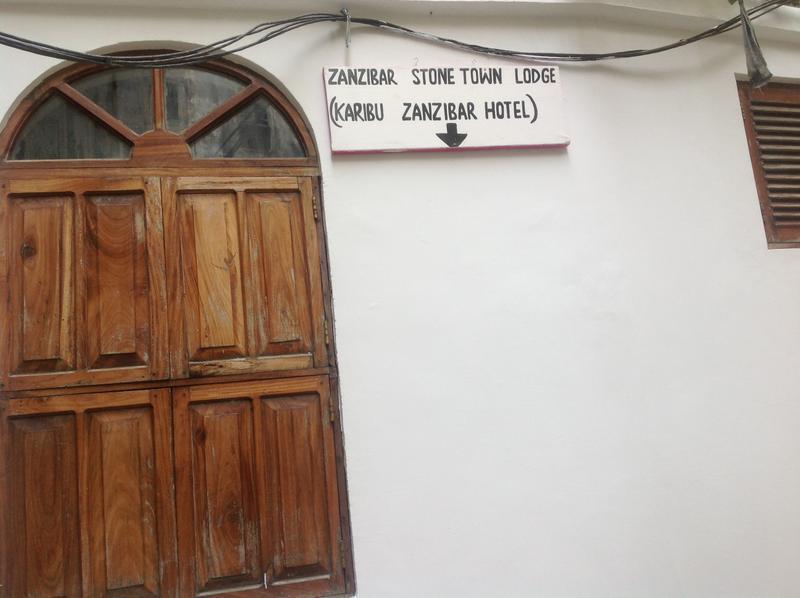
Image resolution: width=800 pixels, height=598 pixels. I want to click on white horizontal rectangle sign on white wall, so click(548, 137).